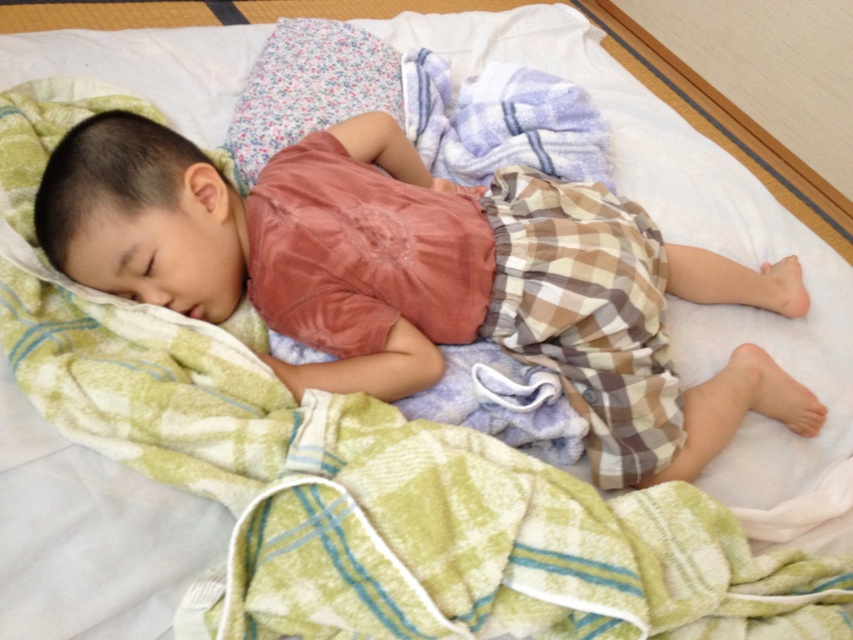
Where is `matte pink shirt at center`? matte pink shirt at center is located at coordinates 422,276.

Does matte pink shirt at center have a smaller size compared to floral fabric pillow at upper center?

Incorrect, matte pink shirt at center is not smaller in size than floral fabric pillow at upper center.

Does point (70, 147) come behind point (256, 129)?

No, it is not.

Find the location of a particular element. matte pink shirt at center is located at coordinates (422, 276).